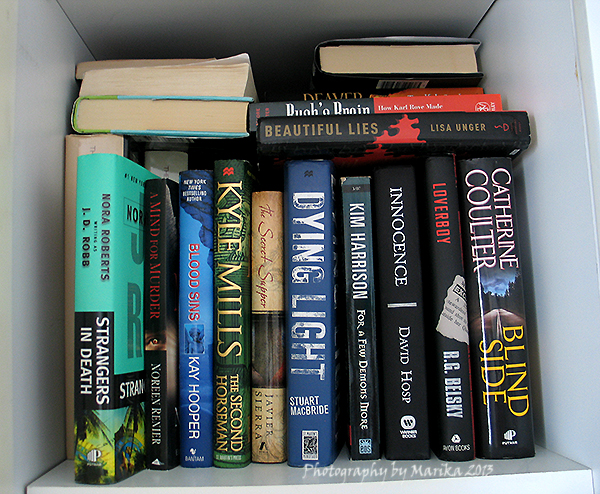
Where is `horizontal books`? The image size is (600, 494). horizontal books is located at coordinates (103, 64), (124, 83), (144, 120), (366, 61), (333, 96), (340, 107), (343, 127).